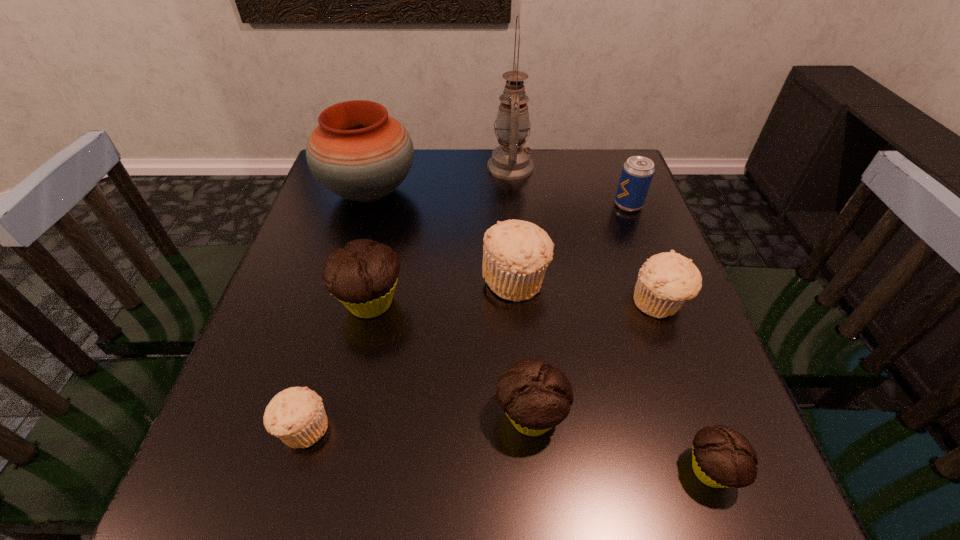
Find the location of a particular element. oil lamp is located at coordinates (510, 161).

Where is `gray oil lamp`? gray oil lamp is located at coordinates (510, 161).

Where is `pottery`? The height and width of the screenshot is (540, 960). pottery is located at coordinates (358, 152).

Locate an element on the screen. The height and width of the screenshot is (540, 960). the second tallest object is located at coordinates (358, 152).

You are a GUI agent. You are given a task and a screenshot of the screen. Output one action in this format:
    pyautogui.click(x=<x>, y=<y>)
    Task: Click on the biggest beige muffin
    
    Given the screenshot: What is the action you would take?
    pyautogui.click(x=516, y=254)

Image resolution: width=960 pixels, height=540 pixels. Identify the location of the biggest chocolate muffin. (363, 275).

The height and width of the screenshot is (540, 960). Identify the location of the leftmost chocolate muffin. (363, 275).

Locate an element on the screen. This screenshot has width=960, height=540. beer can is located at coordinates (637, 173).

What are the coordinates of `the rightmost beige muffin` in the screenshot? It's located at (666, 280).

This screenshot has height=540, width=960. In order to click on the second chocolate muffin from right to left in this screenshot , I will do `click(536, 397)`.